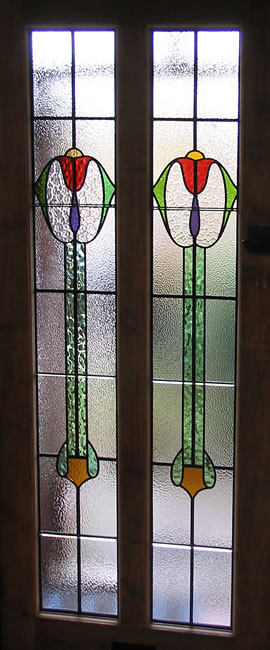
Find the location of a particular element. This screenshot has width=270, height=650. window is located at coordinates (222, 94).